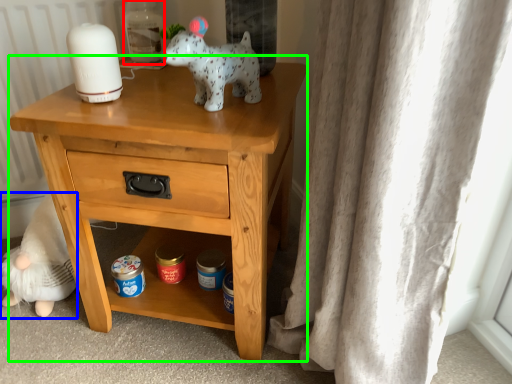
Question: Which is farther away from bottle (highlighted by a red box)? figurine (highlighted by a blue box) or nightstand (highlighted by a green box)?

Choices:
 (A) figurine
 (B) nightstand

Answer: (A)